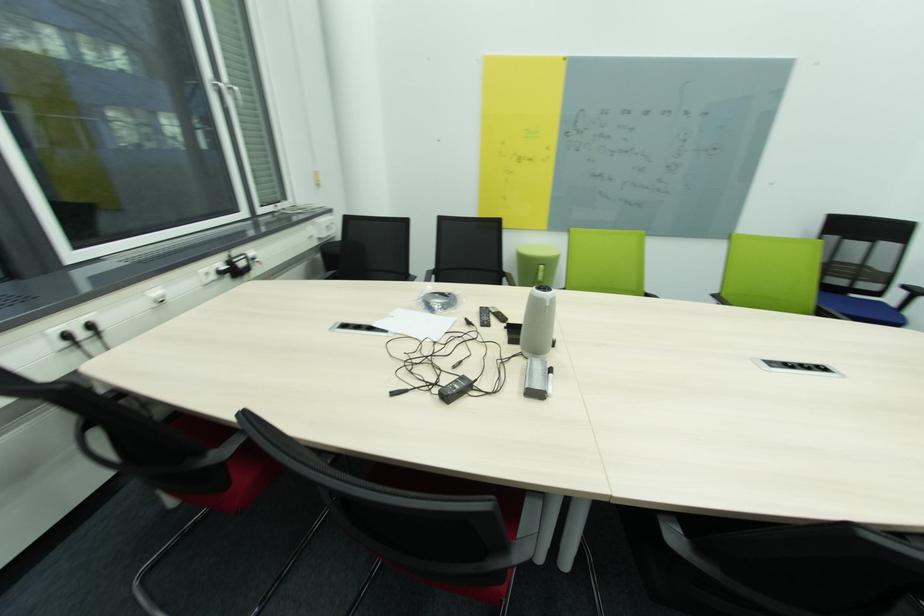
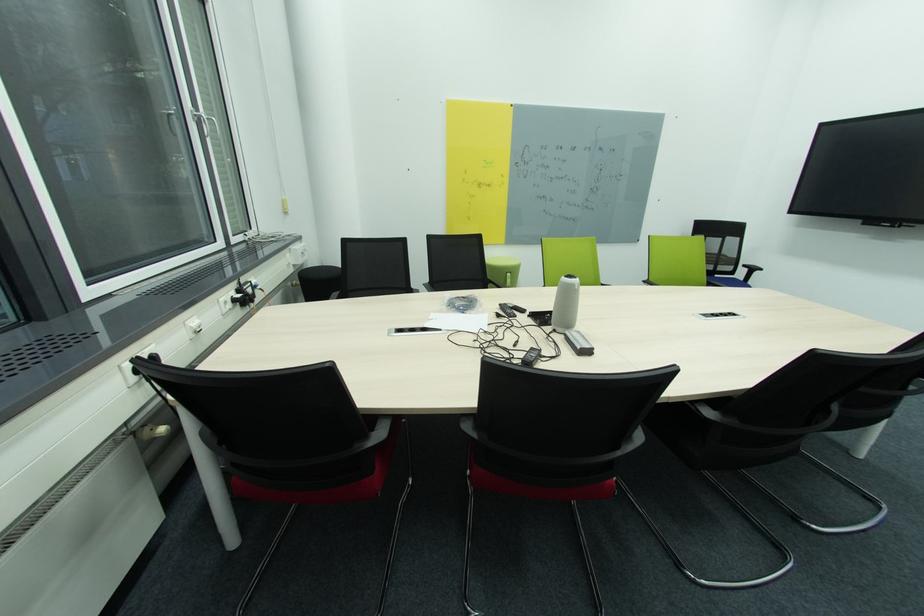
Locate, in the second image, the point that corresponds to [391,333] in the first image.

(444, 331)